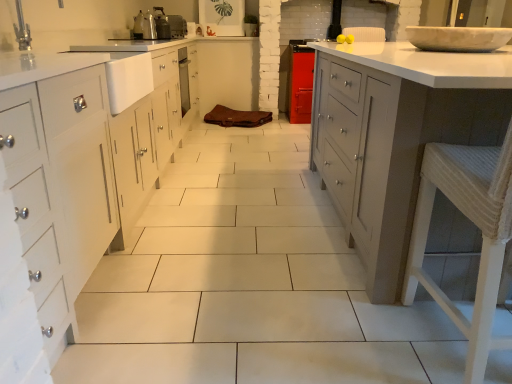
Where is `metallic silver toaster at upper center, positioned as the 2th appliance in back-to-front order`? This screenshot has width=512, height=384. metallic silver toaster at upper center, positioned as the 2th appliance in back-to-front order is located at coordinates (149, 27).

Describe the element at coordinates (396, 136) in the screenshot. I see `white glossy countertop at right` at that location.

Image resolution: width=512 pixels, height=384 pixels. I want to click on white marble bowl at upper right, so click(458, 38).

Does point (152, 23) come closer to viewer compared to point (500, 160)?

No, (152, 23) is further to viewer.

Is metallic silver toaster at upper center, which is the 2th appliance in top-to-bottom order, not near white woven bar stool at right?

Absolutely, metallic silver toaster at upper center, which is the 2th appliance in top-to-bottom order, is distant from white woven bar stool at right.

Which is more to the right, metallic silver toaster at upper center, which ranks as the first appliance in bottom-to-top order, or white woven bar stool at right?

white woven bar stool at right.

Between metallic silver toaster at upper center, positioned as the 2th appliance in back-to-front order, and white woven bar stool at right, which one has more height?

white woven bar stool at right is taller.

Where is `appliance that appears in front of the metallic silver toaster at upper center, acting as the 2th appliance starting from the front`? The height and width of the screenshot is (384, 512). appliance that appears in front of the metallic silver toaster at upper center, acting as the 2th appliance starting from the front is located at coordinates (149, 27).

From the picture: Based on their positions, is metallic silver toaster at upper center, positioned as the 2th appliance in back-to-front order, located to the left or right of metallic silver toaster at upper center, the 1th appliance when ordered from top to bottom?

In the image, metallic silver toaster at upper center, positioned as the 2th appliance in back-to-front order, appears on the left side of metallic silver toaster at upper center, the 1th appliance when ordered from top to bottom.

Considering the sizes of objects metallic silver toaster at upper center, which is the 2th appliance in top-to-bottom order, and metallic silver toaster at upper center, which ranks as the 1th appliance in back-to-front order, in the image provided, who is thinner, metallic silver toaster at upper center, which is the 2th appliance in top-to-bottom order, or metallic silver toaster at upper center, which ranks as the 1th appliance in back-to-front order,?

Thinner between the two is metallic silver toaster at upper center, which is the 2th appliance in top-to-bottom order.

Between white marble bowl at upper right and metallic silver toaster at upper center, which ranks as the first appliance in bottom-to-top order, which one has more height?

With more height is metallic silver toaster at upper center, which ranks as the first appliance in bottom-to-top order.

Is white marble bowl at upper right positioned far away from metallic silver toaster at upper center, which is the 2th appliance in top-to-bottom order?

Yes.

Would you say white marble bowl at upper right is inside or outside metallic silver toaster at upper center, which is the 2th appliance in top-to-bottom order?

white marble bowl at upper right is outside metallic silver toaster at upper center, which is the 2th appliance in top-to-bottom order.

Which object is positioned more to the right, white marble bowl at upper right or metallic silver toaster at upper center, which ranks as the 1th appliance in front-to-back order?

From the viewer's perspective, white marble bowl at upper right appears more on the right side.

Looking at this image, are white woven bar stool at right and white marble bowl at upper right far apart?

white woven bar stool at right is positioned a significant distance from white marble bowl at upper right.

Measure the distance between white woven bar stool at right and white marble bowl at upper right.

3.76 feet.

Consider the image. Is white woven bar stool at right oriented away from white marble bowl at upper right?

white woven bar stool at right does not have its back to white marble bowl at upper right.

In the scene shown: Relative to white marble bowl at upper right, is white woven bar stool at right in front or behind?

In the image, white woven bar stool at right appears in front of white marble bowl at upper right.

This screenshot has height=384, width=512. I want to click on bar stool below the metallic silver toaster at upper center, acting as the 2th appliance starting from the front (from a real-world perspective), so click(476, 225).

From a real-world perspective, between metallic silver toaster at upper center, acting as the 2th appliance starting from the front, and white woven bar stool at right, who is vertically lower?

white woven bar stool at right is physically lower.

Between metallic silver toaster at upper center, the 1th appliance when ordered from top to bottom, and white woven bar stool at right, which one appears on the right side from the viewer's perspective?

Positioned to the right is white woven bar stool at right.

From the image's perspective, is metallic silver toaster at upper center, which is counted as the second appliance, starting from the bottom, under white woven bar stool at right?

No.

From a real-world perspective, is white glossy countertop at right on white woven bar stool at right?

Actually, white glossy countertop at right is physically below white woven bar stool at right in the real world.

At what (x,y) coordinates should I click in order to perform the action: click on bar stool that appears in front of the white glossy countertop at right. Please return your answer as a coordinate pair (x, y). The image size is (512, 384). Looking at the image, I should click on (476, 225).

Is white glossy countertop at right in contact with white woven bar stool at right?

No, white glossy countertop at right is not next to white woven bar stool at right.

Considering the positions of objects white glossy countertop at right and white woven bar stool at right in the image provided, who is in front, white glossy countertop at right or white woven bar stool at right?

white woven bar stool at right is more forward.

Between metallic silver toaster at upper center, which is counted as the second appliance, starting from the bottom, and metallic silver toaster at upper center, which ranks as the first appliance in bottom-to-top order, which one has smaller width?

metallic silver toaster at upper center, which ranks as the first appliance in bottom-to-top order.

Can you confirm if metallic silver toaster at upper center, acting as the 2th appliance starting from the front, is smaller than metallic silver toaster at upper center, which ranks as the first appliance in bottom-to-top order?

No, metallic silver toaster at upper center, acting as the 2th appliance starting from the front, is not smaller than metallic silver toaster at upper center, which ranks as the first appliance in bottom-to-top order.

Does point (172, 35) come closer to viewer compared to point (149, 27)?

No, it is behind (149, 27).

Is metallic silver toaster at upper center, the 1th appliance when ordered from top to bottom, to the right of metallic silver toaster at upper center, positioned as the 2th appliance in back-to-front order, from the viewer's perspective?

Yes, metallic silver toaster at upper center, the 1th appliance when ordered from top to bottom, is to the right of metallic silver toaster at upper center, positioned as the 2th appliance in back-to-front order.

In the image, there is a metallic silver toaster at upper center, which ranks as the first appliance in bottom-to-top order. Identify the location of bar stool below it (from a real-world perspective). This screenshot has height=384, width=512. (476, 225).

The height and width of the screenshot is (384, 512). Find the location of `appliance behind the metallic silver toaster at upper center, positioned as the 2th appliance in back-to-front order`. appliance behind the metallic silver toaster at upper center, positioned as the 2th appliance in back-to-front order is located at coordinates (176, 26).

When comparing their distances from white woven bar stool at right, does metallic silver toaster at upper center, which ranks as the 1th appliance in back-to-front order, or white marble bowl at upper right seem closer?

white marble bowl at upper right is closer to white woven bar stool at right.

Considering their positions, is white marble bowl at upper right positioned closer to white glossy countertop at right than metallic silver toaster at upper center, which is counted as the second appliance, starting from the bottom?

Based on the image, white marble bowl at upper right appears to be nearer to white glossy countertop at right.

Which object lies further to the anchor point metallic silver toaster at upper center, acting as the 2th appliance starting from the front, white woven bar stool at right or white marble bowl at upper right?

The object further to metallic silver toaster at upper center, acting as the 2th appliance starting from the front, is white woven bar stool at right.

Looking at the image, which one is located further to white glossy countertop at right, white marble bowl at upper right or metallic silver toaster at upper center, which ranks as the first appliance in bottom-to-top order?

Among the two, metallic silver toaster at upper center, which ranks as the first appliance in bottom-to-top order, is located further to white glossy countertop at right.

Considering their positions, is white glossy countertop at right positioned closer to metallic silver toaster at upper center, which ranks as the 1th appliance in back-to-front order, than white woven bar stool at right?

white glossy countertop at right is closer to metallic silver toaster at upper center, which ranks as the 1th appliance in back-to-front order.

Estimate the real-world distances between objects in this image. Which object is further from white woven bar stool at right, white marble bowl at upper right or white glossy countertop at right?

Based on the image, white marble bowl at upper right appears to be further to white woven bar stool at right.

Considering their positions, is metallic silver toaster at upper center, which ranks as the 1th appliance in front-to-back order, positioned further to white marble bowl at upper right than white glossy countertop at right?

metallic silver toaster at upper center, which ranks as the 1th appliance in front-to-back order, lies further to white marble bowl at upper right than the other object.

Estimate the real-world distances between objects in this image. Which object is further from white glossy countertop at right, white woven bar stool at right or metallic silver toaster at upper center, the 1th appliance when ordered from top to bottom?

metallic silver toaster at upper center, the 1th appliance when ordered from top to bottom, lies further to white glossy countertop at right than the other object.

Image resolution: width=512 pixels, height=384 pixels. What are the coordinates of `appliance located between white woven bar stool at right and metallic silver toaster at upper center, the 1th appliance when ordered from top to bottom, in the depth direction` in the screenshot? It's located at (149, 27).

At what (x,y) coordinates should I click in order to perform the action: click on home appliance between white glossy countertop at right and metallic silver toaster at upper center, which is the 2th appliance in top-to-bottom order, along the z-axis. Please return your answer as a coordinate pair (x, y). The width and height of the screenshot is (512, 384). Looking at the image, I should click on (458, 38).

This screenshot has width=512, height=384. Find the location of `countertop positioned between white woven bar stool at right and metallic silver toaster at upper center, positioned as the 2th appliance in back-to-front order, from near to far`. countertop positioned between white woven bar stool at right and metallic silver toaster at upper center, positioned as the 2th appliance in back-to-front order, from near to far is located at coordinates click(x=396, y=136).

Where is `home appliance between white glossy countertop at right and metallic silver toaster at upper center, the 1th appliance when ordered from top to bottom, along the z-axis`? home appliance between white glossy countertop at right and metallic silver toaster at upper center, the 1th appliance when ordered from top to bottom, along the z-axis is located at coordinates click(x=458, y=38).